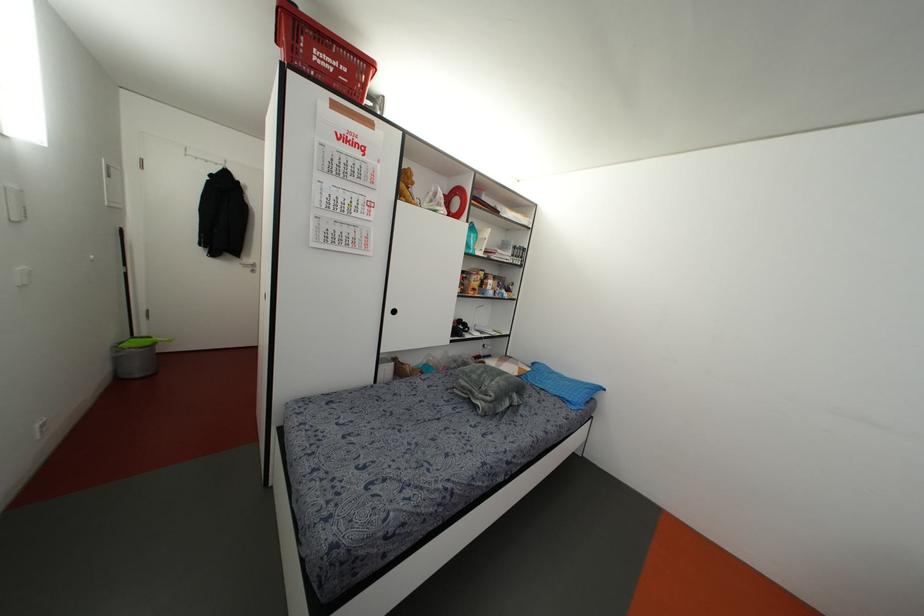
In order to click on silver door handle in this screenshot , I will do `click(248, 265)`.